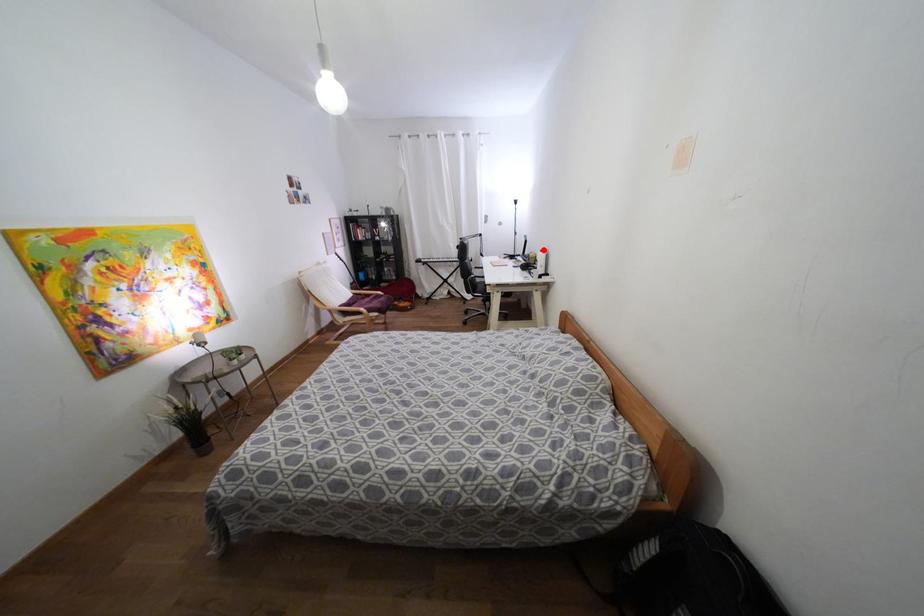
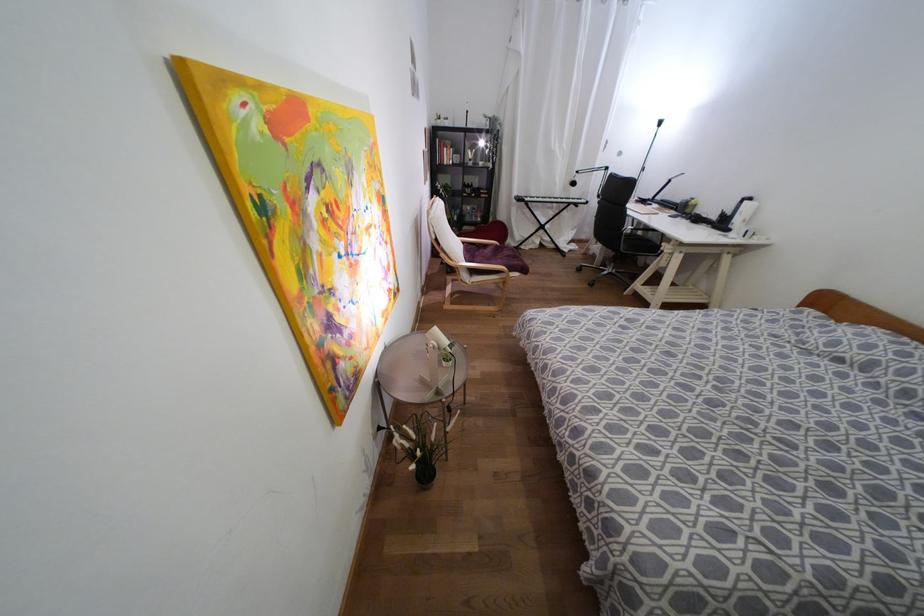
Find the pixel in the second image that matches the highlighted location in the first image.

(749, 198)